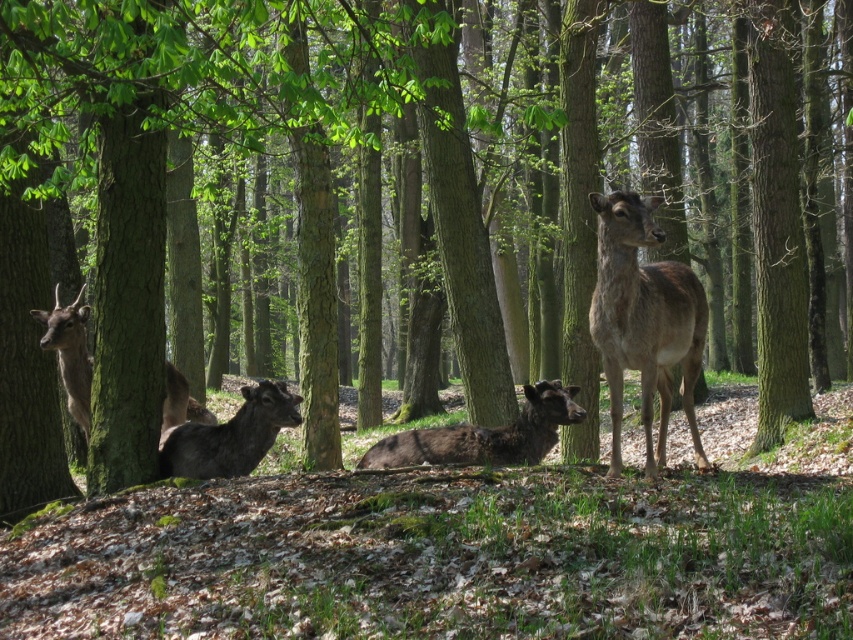
You are a wildlife photographer standing in a forest and see a deer with dark brown fur at center. You want to take a photo from where you are standing. Is the deer within the recommended 10 meter range for clear wildlife photography?

The dark brown fur at center is 8.33 meters away from the camera, which is within the recommended 10 meter range for clear wildlife photography.